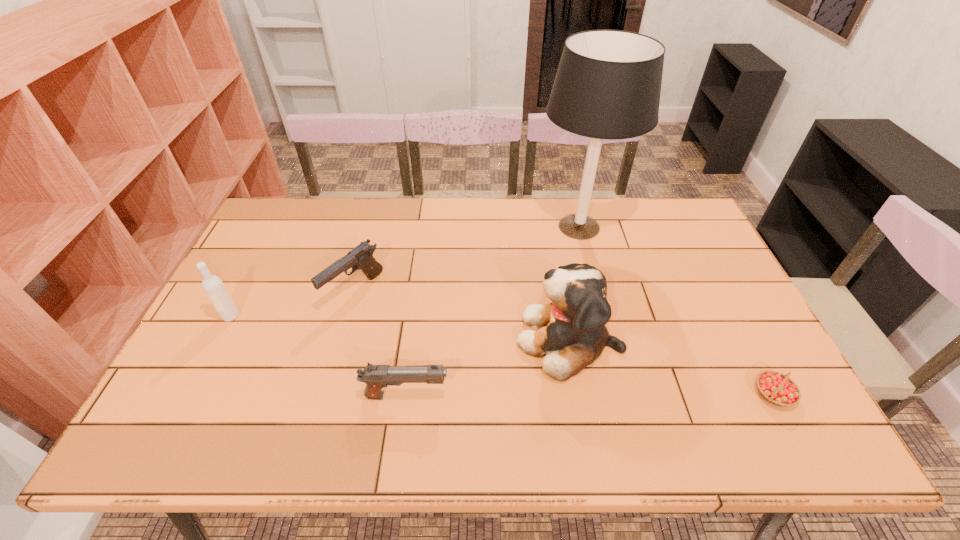
Locate an element on the screen. The height and width of the screenshot is (540, 960). the tallest object is located at coordinates (608, 84).

Where is `the farthest object`? the farthest object is located at coordinates (608, 84).

I want to click on puppy, so click(x=572, y=335).

Find the location of a particular element. the leftmost object is located at coordinates (213, 286).

I want to click on the fourth shortest object, so click(x=213, y=286).

Where is `the farther gun`? This screenshot has height=540, width=960. the farther gun is located at coordinates (361, 257).

Where is `the left gun`? the left gun is located at coordinates (361, 257).

I want to click on the right gun, so click(376, 377).

This screenshot has height=540, width=960. I want to click on the fourth object from right to left, so click(376, 377).

Where is `the rightmost object`? The image size is (960, 540). the rightmost object is located at coordinates (778, 389).